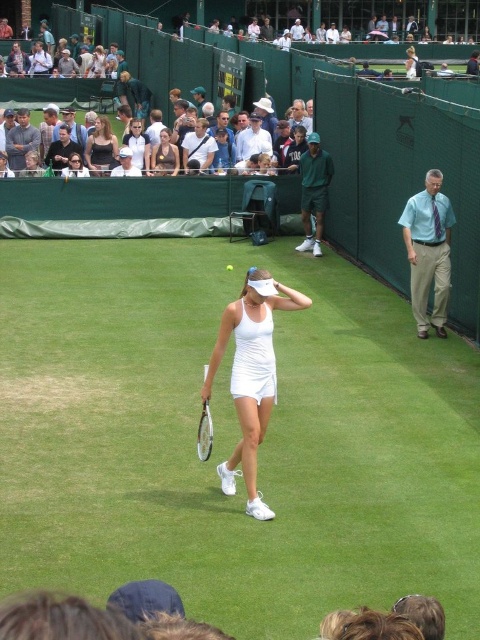
How distant is white fabric tennis court at center from matte brown tank top at upper center?

A distance of 7.31 meters exists between white fabric tennis court at center and matte brown tank top at upper center.

Does white fabric tennis court at center have a lesser height compared to matte brown tank top at upper center?

No, white fabric tennis court at center is not shorter than matte brown tank top at upper center.

Does point (80, 294) come behind point (162, 173)?

No, it is not.

This screenshot has height=640, width=480. I want to click on white fabric tennis court at center, so click(x=230, y=438).

Between white matte tennis outfit at center and white fabric tennis outfit at center, which one appears on the right side from the viewer's perspective?

Positioned to the right is white matte tennis outfit at center.

Is white matte tennis outfit at center below white fabric tennis outfit at center?

Yes, white matte tennis outfit at center is below white fabric tennis outfit at center.

Who is more distant from viewer, [269,344] or [141,148]?

Positioned behind is point [141,148].

Identify the location of white matte tennis outfit at center. (251, 374).

Does white matte tennis racket at center have a larger size compared to yellow rubber tennis ball at center?

Correct, white matte tennis racket at center is larger in size than yellow rubber tennis ball at center.

Which is in front, point (204, 417) or point (229, 262)?

Positioned in front is point (204, 417).

Where is `white matte tennis racket at center`? The image size is (480, 640). white matte tennis racket at center is located at coordinates [204, 433].